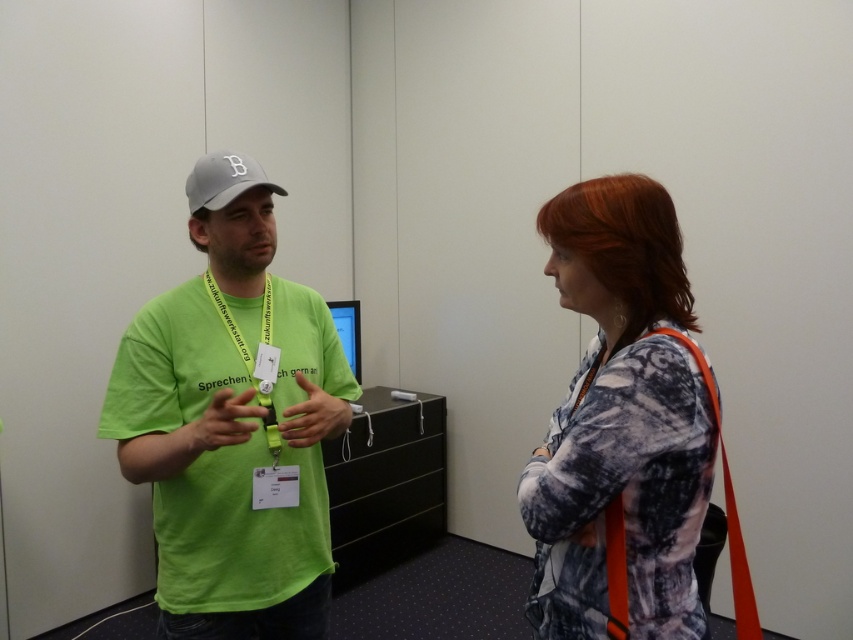
Is point (224, 502) closer to camera compared to point (187, 198)?

Yes, point (224, 502) is closer to viewer.

Does green matte t-shirt at center have a lesser height compared to gray fabric baseball cap at upper left?

No.

Describe the element at coordinates (233, 422) in the screenshot. Image resolution: width=853 pixels, height=640 pixels. I see `green matte t-shirt at center` at that location.

I want to click on green matte t-shirt at center, so click(x=233, y=422).

Between point (682, 467) and point (229, 177), which one is positioned in front?

Point (682, 467) is in front.

Is patterned fabric blouse at right wider than gray fabric baseball cap at upper left?

Indeed, patterned fabric blouse at right has a greater width compared to gray fabric baseball cap at upper left.

This screenshot has width=853, height=640. What do you see at coordinates (619, 420) in the screenshot?
I see `patterned fabric blouse at right` at bounding box center [619, 420].

Locate an element on the screen. This screenshot has height=640, width=853. patterned fabric blouse at right is located at coordinates (619, 420).

Image resolution: width=853 pixels, height=640 pixels. I want to click on green matte t-shirt at center, so click(233, 422).

What do you see at coordinates (233, 422) in the screenshot? Image resolution: width=853 pixels, height=640 pixels. I see `green matte t-shirt at center` at bounding box center [233, 422].

Where is `green matte t-shirt at center`? green matte t-shirt at center is located at coordinates (233, 422).